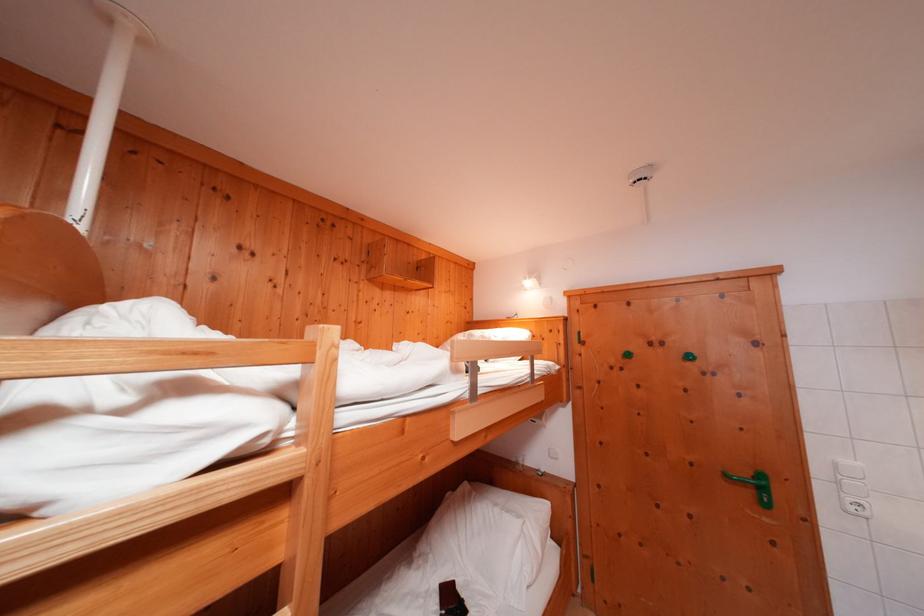
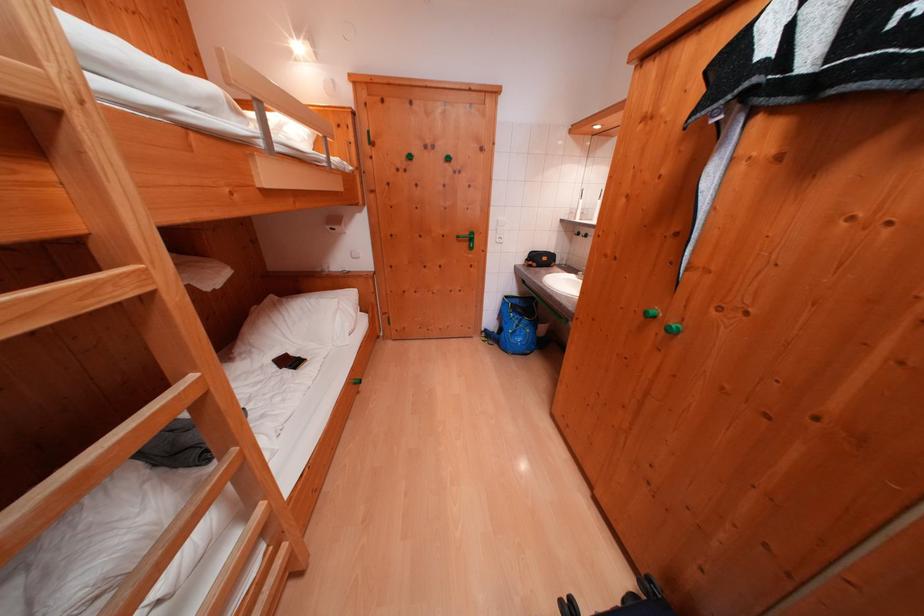
In the second image, find the point that corresponds to point 734,480 in the first image.

(466, 241)